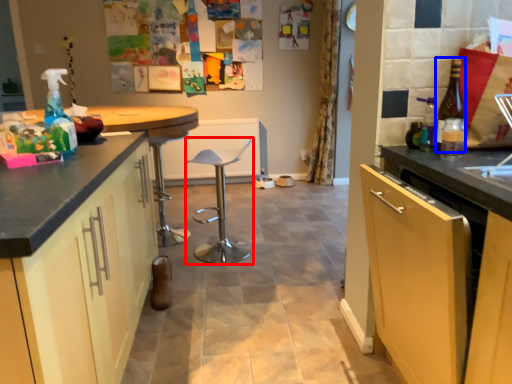
Question: Which object appears farthest to the camera in this image, bar stool (highlighted by a red box) or bottle (highlighted by a blue box)?

Choices:
 (A) bar stool
 (B) bottle

Answer: (A)